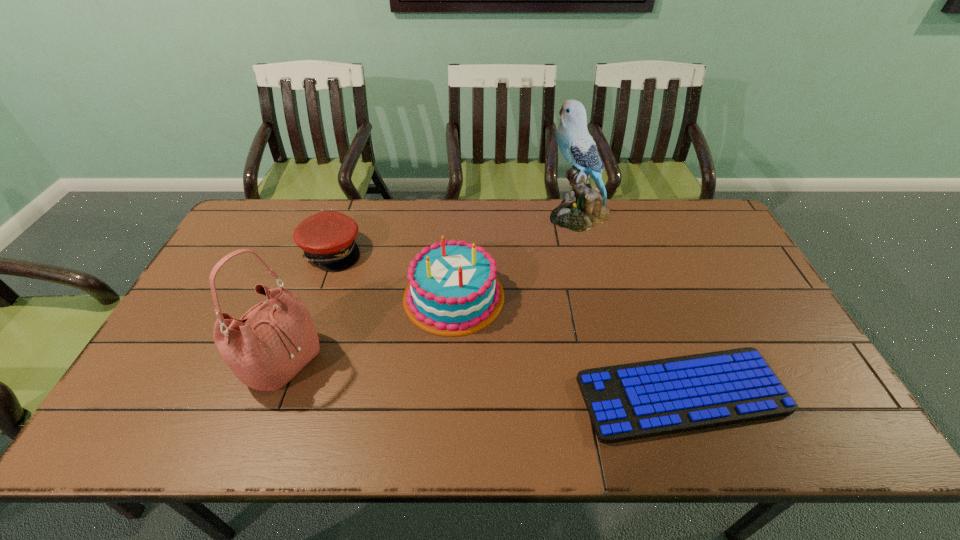
Where is `free point located on the left of the third object from left to right`? The image size is (960, 540). free point located on the left of the third object from left to right is located at coordinates (349, 296).

This screenshot has height=540, width=960. Find the location of `vacant space positioned on the front-facing side of the second shortest object`. vacant space positioned on the front-facing side of the second shortest object is located at coordinates (408, 251).

This screenshot has height=540, width=960. What are the coordinates of `free space located 0.370m on the back of the shortest object` in the screenshot? It's located at (633, 256).

Where is `parakeet at the far edge`? The image size is (960, 540). parakeet at the far edge is located at coordinates (587, 209).

Find the location of a particular element. cap that is at the far edge is located at coordinates (327, 238).

Image resolution: width=960 pixels, height=540 pixels. What are the coordinates of `object positioned at the near edge` in the screenshot? It's located at (625, 402).

Where is `object that is at the right edge`? Image resolution: width=960 pixels, height=540 pixels. object that is at the right edge is located at coordinates (625, 402).

Find the location of a particular element. The width and height of the screenshot is (960, 540). object that is at the near right corner is located at coordinates (625, 402).

In the image, there is a desktop. What are the coordinates of `vacant space at the far edge` in the screenshot? It's located at click(x=410, y=213).

You are a GUI agent. You are given a task and a screenshot of the screen. Output one action in this format:
    pyautogui.click(x=<x>, y=<y>)
    Task: Click on the free location at the near edge
    The height and width of the screenshot is (540, 960).
    Given the screenshot: What is the action you would take?
    pyautogui.click(x=393, y=446)